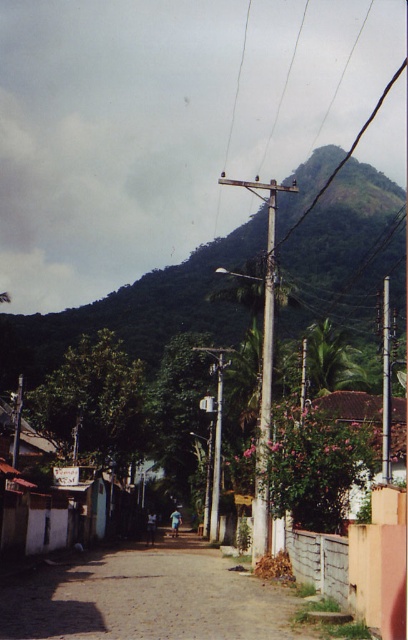
Question: Is brown cobblestone alley at center smaller than brown wooden pole at upper center?

Choices:
 (A) no
 (B) yes

Answer: (B)

Question: Can you confirm if brown cobblestone alley at center is wider than brown wooden pole at upper center?

Choices:
 (A) yes
 (B) no

Answer: (B)

Question: Is brown cobblestone alley at center bigger than brown wooden pole at upper center?

Choices:
 (A) no
 (B) yes

Answer: (A)

Question: Among these objects, which one is farthest from the camera?

Choices:
 (A) brown cobblestone alley at center
 (B) brown wooden pole at upper center

Answer: (B)

Question: Which object is farther from the camera taking this photo?

Choices:
 (A) brown wooden pole at upper center
 (B) brown cobblestone alley at center

Answer: (A)

Question: Among these points, which one is farthest from the camera?

Choices:
 (A) [x=367, y=120]
 (B) [x=234, y=608]

Answer: (A)